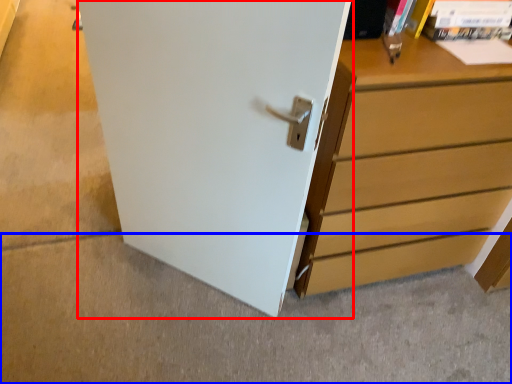
Question: Among these objects, which one is nearest to the camera, door (highlighted by a red box) or concrete (highlighted by a blue box)?

Choices:
 (A) door
 (B) concrete

Answer: (A)